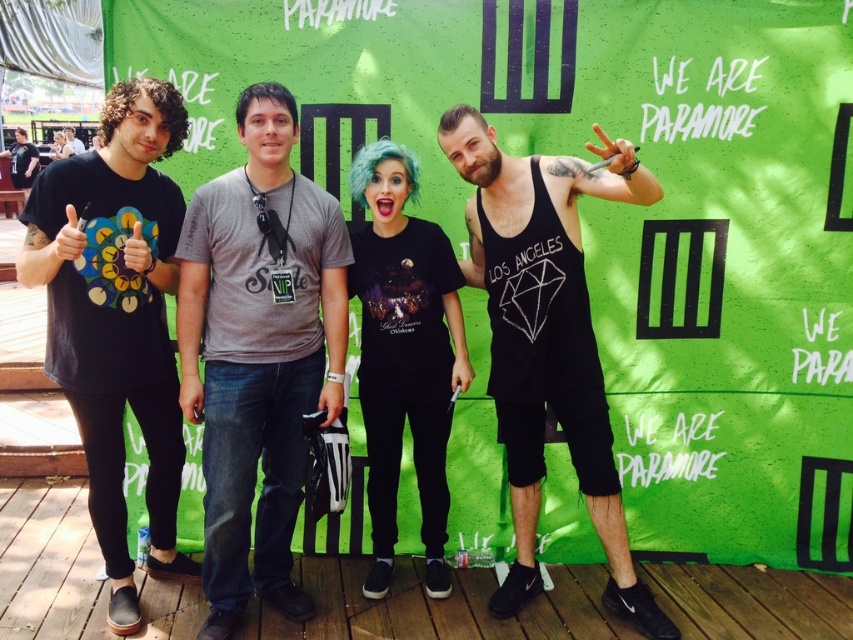
Question: Which of the following is the farthest from the observer?

Choices:
 (A) (318, 253)
 (B) (398, 202)
 (C) (498, 275)
 (D) (161, 376)

Answer: (C)

Question: Does gray cotton t-shirt at center have a greater width compared to matte black t-shirt at left?

Choices:
 (A) no
 (B) yes

Answer: (B)

Question: Does matte black t-shirt at left appear on the right side of black tank top at center?

Choices:
 (A) yes
 (B) no

Answer: (B)

Question: Which of the following is the farthest from the observer?

Choices:
 (A) gray cotton t-shirt at center
 (B) black tank top at center
 (C) black matte t-shirt at center

Answer: (C)

Question: Which of the following is the farthest from the observer?

Choices:
 (A) black matte t-shirt at center
 (B) gray cotton t-shirt at center
 (C) matte black t-shirt at left

Answer: (A)

Question: Considering the relative positions of matte black t-shirt at left and black tank top at center in the image provided, where is matte black t-shirt at left located with respect to black tank top at center?

Choices:
 (A) left
 (B) right

Answer: (A)